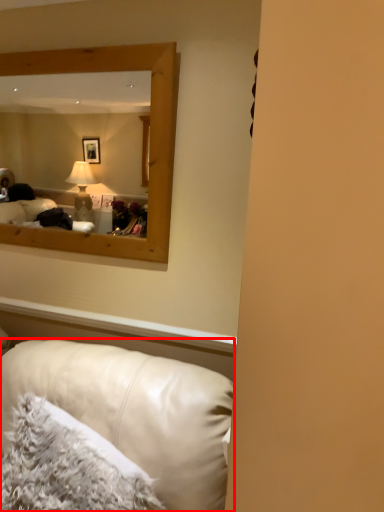
Question: From the image's perspective, what is the correct spatial positioning of studio couch (annotated by the red box) in reference to pillow?

Choices:
 (A) above
 (B) below

Answer: (B)